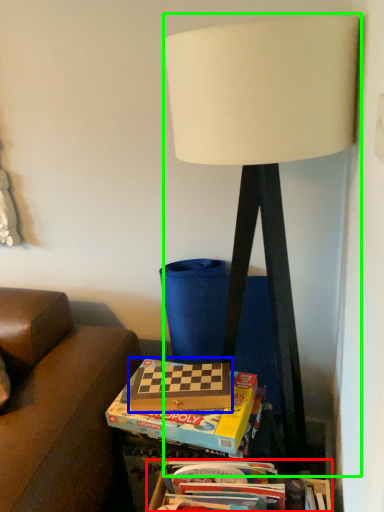
Question: Which object is positioned farthest from box (highlighted by a red box)? Select from paperback book (highlighted by a blue box) and lamp (highlighted by a green box).

Choices:
 (A) paperback book
 (B) lamp

Answer: (B)